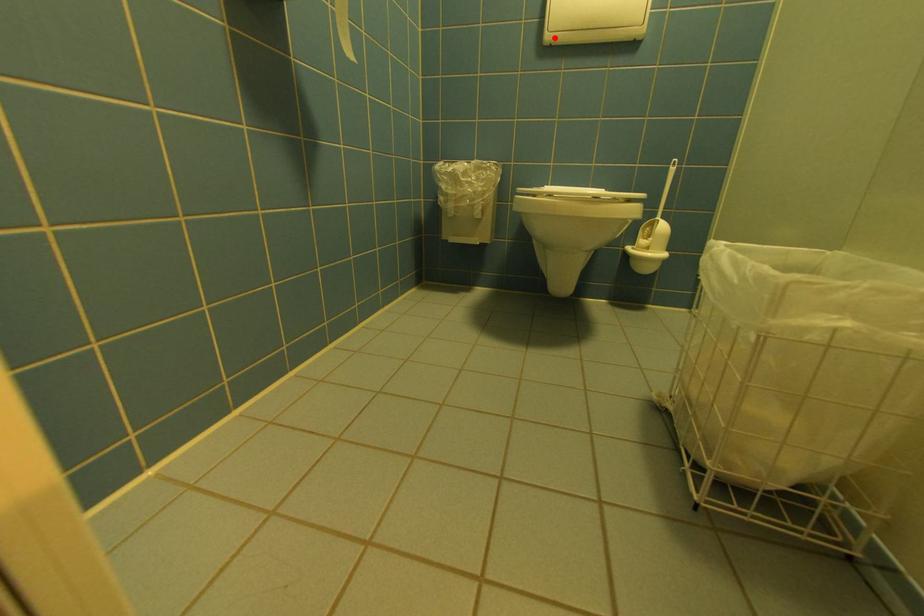
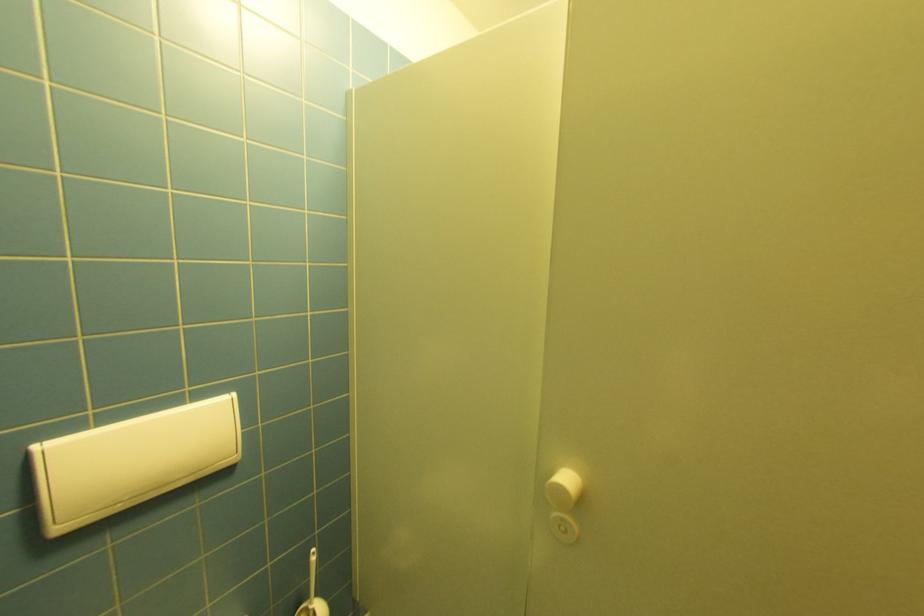
Question: I am providing you with two images of the same scene from different viewpoints. A red point is shown in image1. For the corresponding object point in image2, is it positioned nearer or farther from the camera?

Choices:
 (A) Nearer
 (B) Farther

Answer: (A)